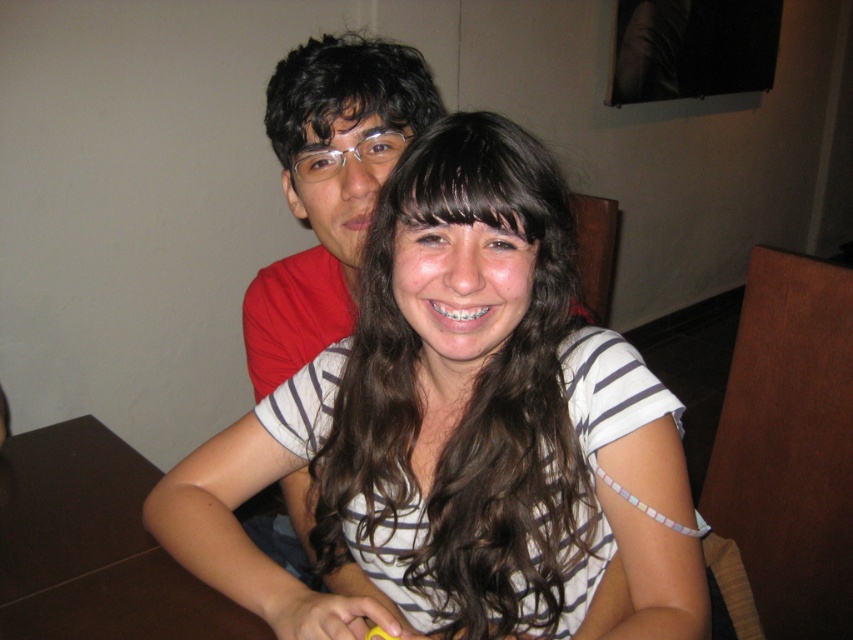
Question: Is white striped shirt at center thinner than matte red shirt at center?

Choices:
 (A) yes
 (B) no

Answer: (B)

Question: Which of the following is the closest to the observer?

Choices:
 (A) matte red shirt at center
 (B) white striped shirt at center

Answer: (B)

Question: Does white striped shirt at center have a larger size compared to matte red shirt at center?

Choices:
 (A) no
 (B) yes

Answer: (A)

Question: Which object appears farthest from the camera in this image?

Choices:
 (A) matte red shirt at center
 (B) white striped shirt at center

Answer: (A)

Question: Is white striped shirt at center to the right of matte red shirt at center from the viewer's perspective?

Choices:
 (A) no
 (B) yes

Answer: (B)